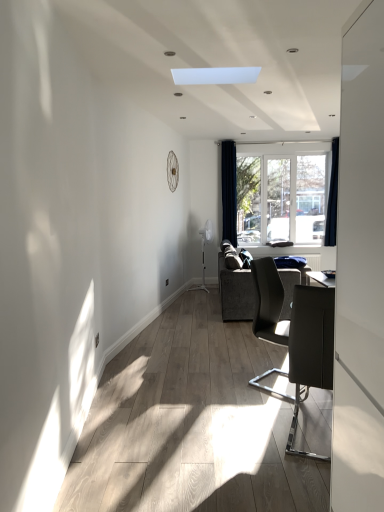
Question: Can you confirm if dark blue velvet curtain at right, the first curtain when ordered from left to right, is bigger than dark blue fabric curtain at right, the second curtain from the left?

Choices:
 (A) yes
 (B) no

Answer: (A)

Question: Is dark blue fabric curtain at right, the second curtain from the left, at the back of dark blue velvet curtain at right, acting as the second curtain starting from the right?

Choices:
 (A) yes
 (B) no

Answer: (B)

Question: From the image's perspective, is dark blue velvet curtain at right, acting as the second curtain starting from the right, under dark blue fabric curtain at right, the second curtain from the left?

Choices:
 (A) yes
 (B) no

Answer: (A)

Question: Would you say dark blue velvet curtain at right, acting as the second curtain starting from the right, is outside dark blue fabric curtain at right, the second curtain from the left?

Choices:
 (A) yes
 (B) no

Answer: (A)

Question: Considering the relative sizes of dark blue velvet curtain at right, the first curtain when ordered from left to right, and dark blue fabric curtain at right, which is the first curtain in right-to-left order, in the image provided, is dark blue velvet curtain at right, the first curtain when ordered from left to right, thinner than dark blue fabric curtain at right, which is the first curtain in right-to-left order,?

Choices:
 (A) no
 (B) yes

Answer: (A)

Question: Is white glossy screen door at right bigger or smaller than matte black chair at right, which is the second chair from back to front?

Choices:
 (A) small
 (B) big

Answer: (B)

Question: Considering the positions of point (342, 244) and point (321, 387), is point (342, 244) closer or farther from the camera than point (321, 387)?

Choices:
 (A) closer
 (B) farther

Answer: (A)

Question: Is white glossy screen door at right wider or thinner than matte black chair at right, which is the second chair from back to front?

Choices:
 (A) thin
 (B) wide

Answer: (A)

Question: Considering the positions of white glossy screen door at right and matte black chair at right, which is the second chair from back to front, in the image, is white glossy screen door at right taller or shorter than matte black chair at right, which is the second chair from back to front,?

Choices:
 (A) short
 (B) tall

Answer: (B)

Question: In terms of size, does dark gray fabric couch at center appear bigger or smaller than clear glass window at center?

Choices:
 (A) small
 (B) big

Answer: (B)

Question: From a real-world perspective, is dark gray fabric couch at center above or below clear glass window at center?

Choices:
 (A) above
 (B) below

Answer: (B)

Question: From the image's perspective, relative to clear glass window at center, is dark gray fabric couch at center above or below?

Choices:
 (A) above
 (B) below

Answer: (B)

Question: In the image, is dark gray fabric couch at center positioned in front of or behind clear glass window at center?

Choices:
 (A) front
 (B) behind

Answer: (A)

Question: From the image's perspective, is dark blue fabric curtain at right, which is the first curtain in right-to-left order, above or below clear glass window at center?

Choices:
 (A) above
 (B) below

Answer: (A)

Question: Based on their sizes in the image, would you say dark blue fabric curtain at right, the second curtain from the left, is bigger or smaller than clear glass window at center?

Choices:
 (A) big
 (B) small

Answer: (B)